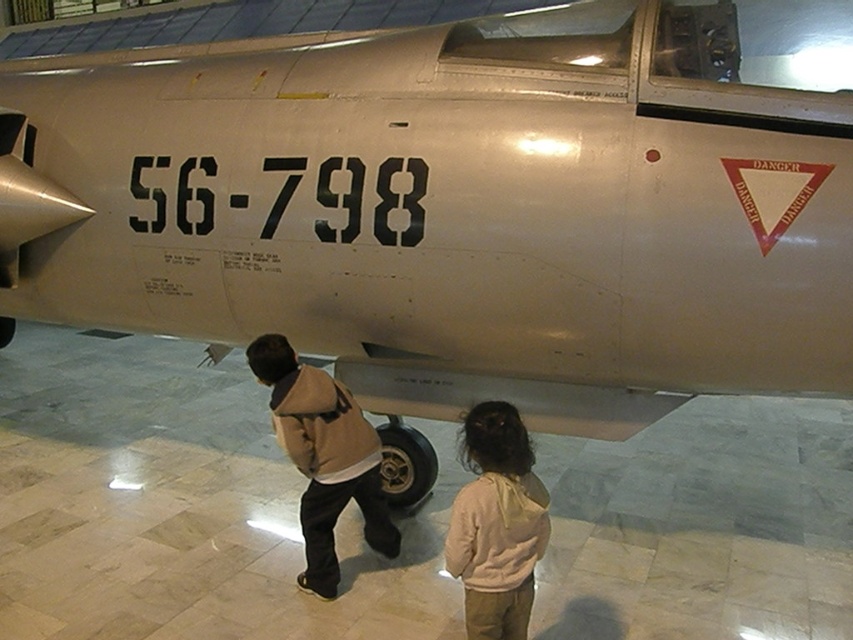
Question: Is white fleece hoodie at lower center wider than black rubber tire at center?

Choices:
 (A) yes
 (B) no

Answer: (A)

Question: Does tan suede jacket at lower center appear on the left side of black rubber tire at center?

Choices:
 (A) no
 (B) yes

Answer: (B)

Question: Is white fleece hoodie at lower center wider than tan suede jacket at lower center?

Choices:
 (A) no
 (B) yes

Answer: (A)

Question: Estimate the real-world distances between objects in this image. Which object is closer to the black rubber tire at center?

Choices:
 (A) tan suede jacket at lower center
 (B) white fleece hoodie at lower center

Answer: (A)

Question: Which object is farther from the camera taking this photo?

Choices:
 (A) white fleece hoodie at lower center
 (B) tan suede jacket at lower center
 (C) black rubber tire at center

Answer: (C)

Question: Which is farther from the black rubber tire at center?

Choices:
 (A) white fleece hoodie at lower center
 (B) tan suede jacket at lower center

Answer: (A)